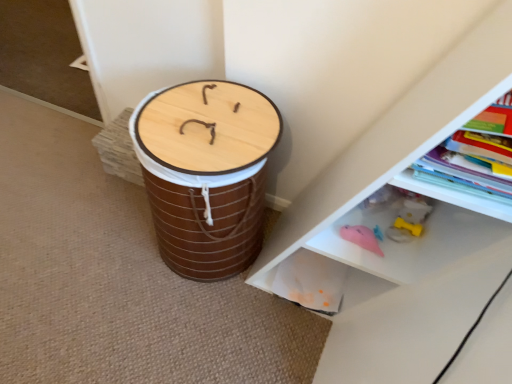
Question: Is point (257, 162) positioned closer to the camera than point (437, 183)?

Choices:
 (A) farther
 (B) closer

Answer: (A)

Question: Visually, is wooden drum at center positioned to the left or to the right of hardcover book at upper right?

Choices:
 (A) left
 (B) right

Answer: (A)

Question: Estimate the real-world distances between objects in this image. Which object is closer to the hardcover book at upper right?

Choices:
 (A) wooden drum at center
 (B) white plastic shelf at lower right

Answer: (B)

Question: Estimate the real-world distances between objects in this image. Which object is farther from the white plastic shelf at lower right?

Choices:
 (A) wooden drum at center
 (B) hardcover book at upper right

Answer: (A)